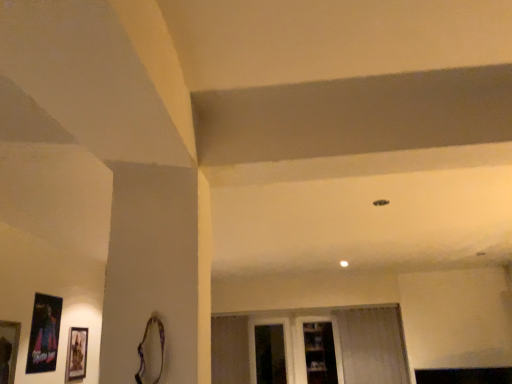
Question: Is white sheer curtain at lower right positioned beyond the bounds of transparent glass door at center?

Choices:
 (A) no
 (B) yes

Answer: (B)

Question: Is white sheer curtain at lower right shorter than transparent glass door at center?

Choices:
 (A) no
 (B) yes

Answer: (A)

Question: Is white sheer curtain at lower right further to the viewer compared to transparent glass door at center?

Choices:
 (A) yes
 (B) no

Answer: (B)

Question: Is white sheer curtain at lower right at the right side of transparent glass door at center?

Choices:
 (A) yes
 (B) no

Answer: (A)

Question: Is white sheer curtain at lower right oriented away from transparent glass door at center?

Choices:
 (A) yes
 (B) no

Answer: (B)

Question: Considering the relative sizes of white sheer curtain at lower right and transparent glass door at center in the image provided, is white sheer curtain at lower right taller than transparent glass door at center?

Choices:
 (A) no
 (B) yes

Answer: (B)

Question: Is the depth of wooden picture frame at lower left, marked as the first picture frame in a front-to-back arrangement, less than that of matte black picture frame at lower left, the 1th picture frame in the back-to-front sequence?

Choices:
 (A) no
 (B) yes

Answer: (B)

Question: Is wooden picture frame at lower left, the third picture frame in the back-to-front sequence, to the right of matte black picture frame at lower left, the 1th picture frame in the back-to-front sequence, from the viewer's perspective?

Choices:
 (A) no
 (B) yes

Answer: (A)

Question: Is wooden picture frame at lower left, the third picture frame in the back-to-front sequence, with matte black picture frame at lower left, the 1th picture frame in the back-to-front sequence?

Choices:
 (A) yes
 (B) no

Answer: (B)

Question: Can you confirm if wooden picture frame at lower left, the third picture frame in the back-to-front sequence, is taller than matte black picture frame at lower left, which is the third picture frame in front-to-back order?

Choices:
 (A) no
 (B) yes

Answer: (A)

Question: Is wooden picture frame at lower left, the third picture frame in the back-to-front sequence, turned away from matte black picture frame at lower left, the 1th picture frame in the back-to-front sequence?

Choices:
 (A) yes
 (B) no

Answer: (B)

Question: Is wooden picture frame at lower left, marked as the first picture frame in a front-to-back arrangement, shorter than matte black picture frame at lower left, which is the third picture frame in front-to-back order?

Choices:
 (A) no
 (B) yes

Answer: (B)

Question: Would you say wooden picture frame at lower left, the third picture frame in the back-to-front sequence, is part of clear glass shelves at center's contents?

Choices:
 (A) no
 (B) yes

Answer: (A)